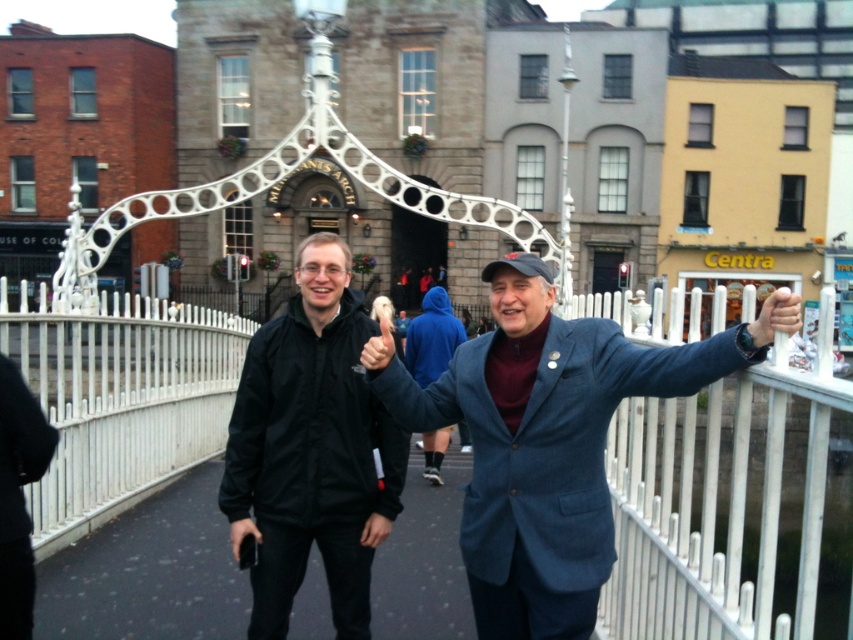
Question: Can you confirm if black matte jacket at center is smaller than smooth plastic hand at upper right?

Choices:
 (A) yes
 (B) no

Answer: (A)

Question: Can you confirm if denim jacket at center is positioned below smooth plastic hand at upper right?

Choices:
 (A) no
 (B) yes

Answer: (B)

Question: Which object appears farthest from the camera in this image?

Choices:
 (A) white metal fence at center
 (B) black matte jacket at center
 (C) smooth plastic hand at upper right

Answer: (A)

Question: Which point is farther to the camera?

Choices:
 (A) white metal bridge at center
 (B) black matte jacket at center
 (C) denim jacket at center

Answer: (A)

Question: Is white metal railing at right closer to camera compared to black matte jacket at center?

Choices:
 (A) yes
 (B) no

Answer: (A)

Question: Which object is positioned closest to the white metal fence at center?

Choices:
 (A) white metal bridge at center
 (B) smooth plastic hand at upper right

Answer: (A)